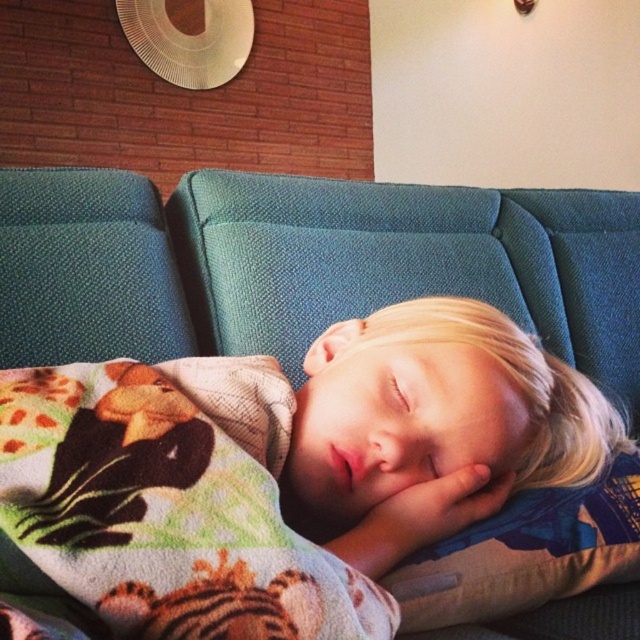
Question: Is multicolored fleece blanket at center to the left of soft fabric pillow at center from the viewer's perspective?

Choices:
 (A) yes
 (B) no

Answer: (A)

Question: Among these points, which one is farthest from the camera?

Choices:
 (A) (154, 416)
 (B) (632, 481)
 (C) (74, 205)

Answer: (C)

Question: Based on their relative distances, which object is nearer to the soft fabric pillow at center?

Choices:
 (A) multicolored fleece blanket at center
 (B) teal fabric couch at center

Answer: (A)

Question: Is multicolored fleece blanket at center smaller than soft fabric pillow at center?

Choices:
 (A) yes
 (B) no

Answer: (B)

Question: Can you confirm if teal fabric couch at center is positioned to the left of soft fabric pillow at center?

Choices:
 (A) no
 (B) yes

Answer: (B)

Question: Among these points, which one is farthest from the camera?

Choices:
 (A) (77, 264)
 (B) (13, 497)
 (C) (547, 556)

Answer: (A)